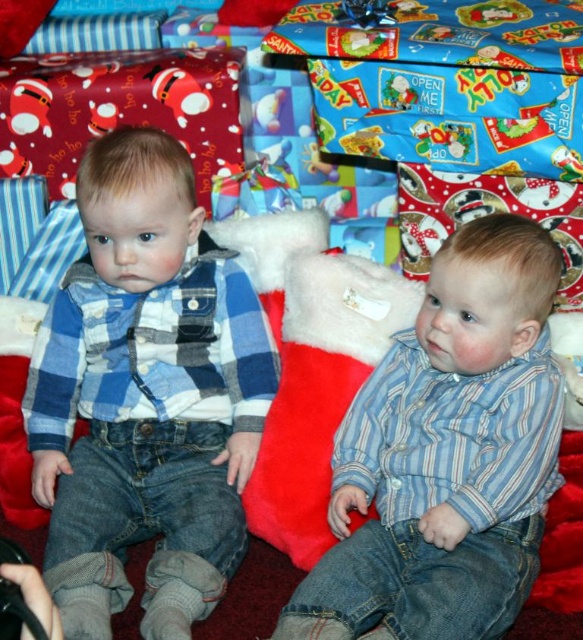
Question: Can you confirm if blue plaid shirt at left is bigger than blue striped shirt at center?

Choices:
 (A) no
 (B) yes

Answer: (B)

Question: Is blue plaid shirt at left bigger than blue striped shirt at center?

Choices:
 (A) yes
 (B) no

Answer: (A)

Question: Which point is farther from the camera taking this photo?

Choices:
 (A) (465, 620)
 (B) (208, 262)

Answer: (B)

Question: Observing the image, what is the correct spatial positioning of blue plaid shirt at left in reference to blue striped shirt at center?

Choices:
 (A) below
 (B) above

Answer: (B)

Question: Among these objects, which one is farthest from the camera?

Choices:
 (A) blue striped shirt at center
 (B) blue plaid shirt at left

Answer: (B)

Question: Which of the following is the closest to the observer?

Choices:
 (A) (314, 576)
 (B) (101, 416)

Answer: (A)